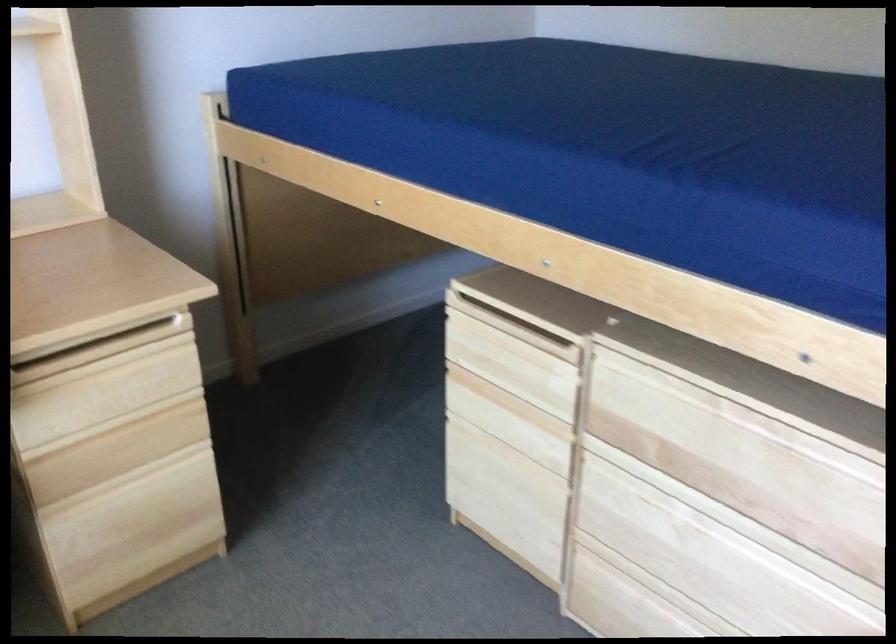
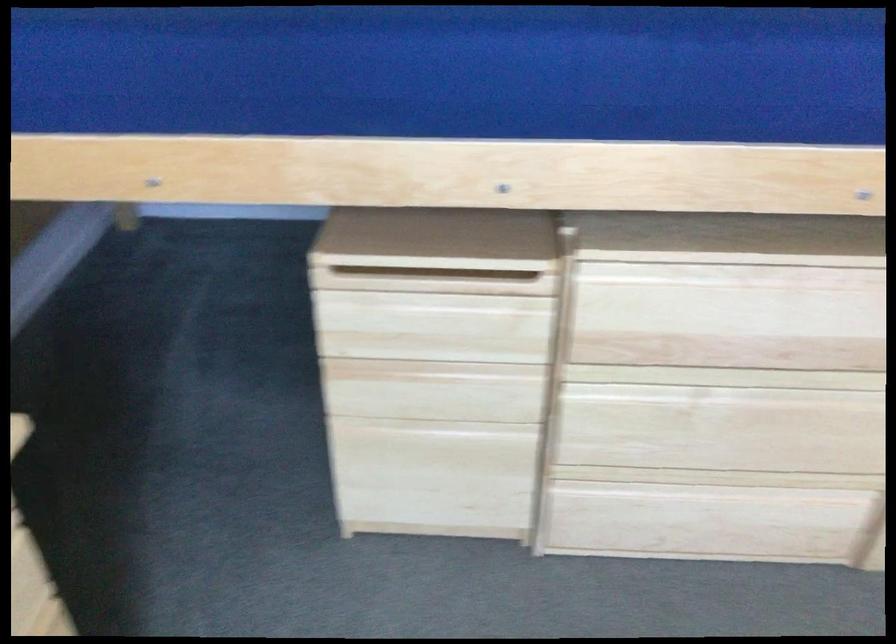
Locate, in the second image, the point that corresponds to (x=705, y=506) in the first image.

(728, 377)